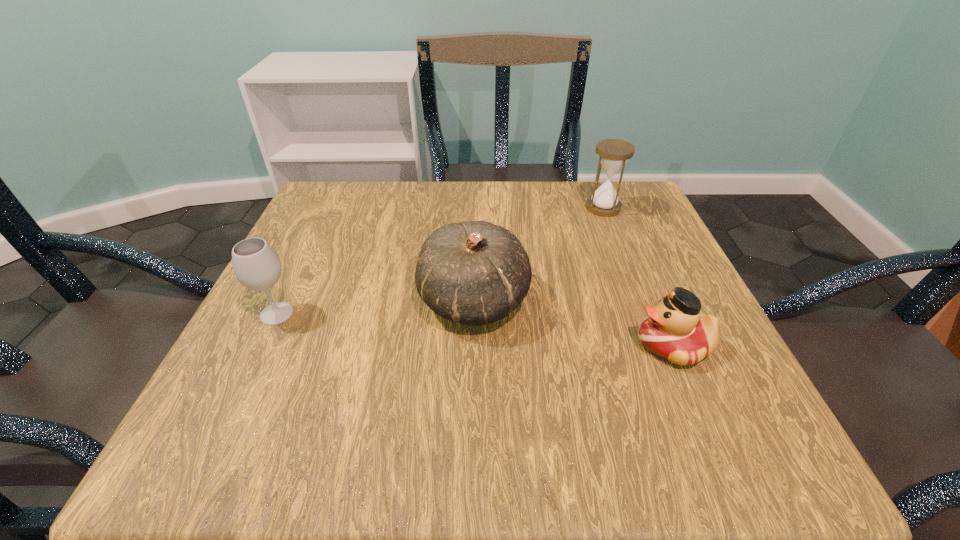
Locate an element on the screen. This screenshot has width=960, height=540. blank space at the far right corner is located at coordinates coord(595,230).

The width and height of the screenshot is (960, 540). I want to click on vacant area that lies between the gourd and the duck, so click(573, 323).

This screenshot has width=960, height=540. What are the coordinates of `free space between the gourd and the hourglass` in the screenshot? It's located at (539, 254).

Image resolution: width=960 pixels, height=540 pixels. In order to click on free space between the second object from left to right and the duck in this screenshot , I will do `click(573, 323)`.

At what (x,y) coordinates should I click in order to perform the action: click on empty space that is in between the hourglass and the gourd. Please return your answer as a coordinate pair (x, y). This screenshot has width=960, height=540. Looking at the image, I should click on (539, 254).

This screenshot has width=960, height=540. I want to click on free space that is in between the wineglass and the gourd, so click(x=375, y=307).

What are the coordinates of `free space that is in between the duck and the leftmost object` in the screenshot? It's located at (475, 329).

Find the location of a particular element. This screenshot has height=540, width=960. vacant point located between the third object from right to left and the hourglass is located at coordinates (539, 254).

Locate an element on the screen. blank region between the wineglass and the gourd is located at coordinates (375, 307).

Locate an element on the screen. The width and height of the screenshot is (960, 540). vacant area between the gourd and the leftmost object is located at coordinates (375, 307).